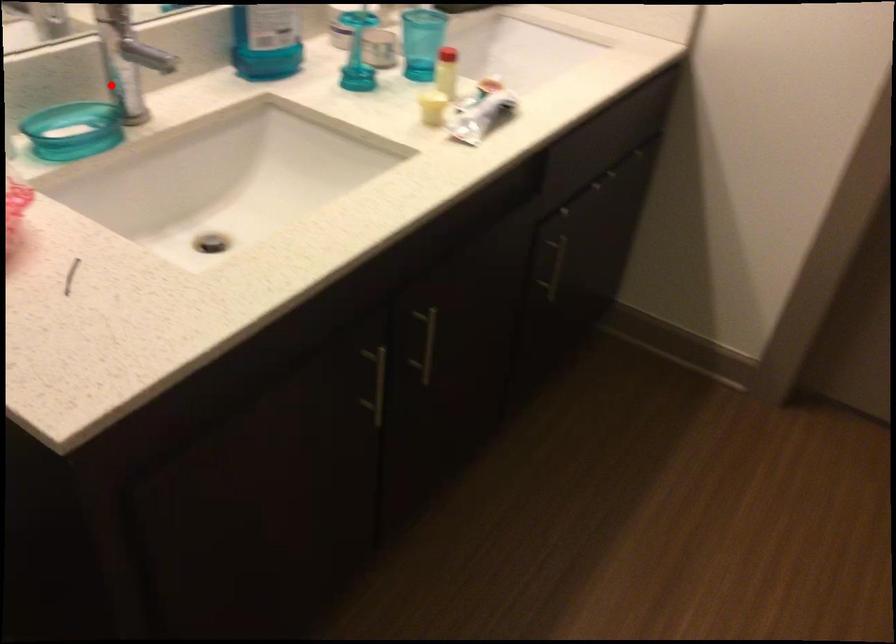
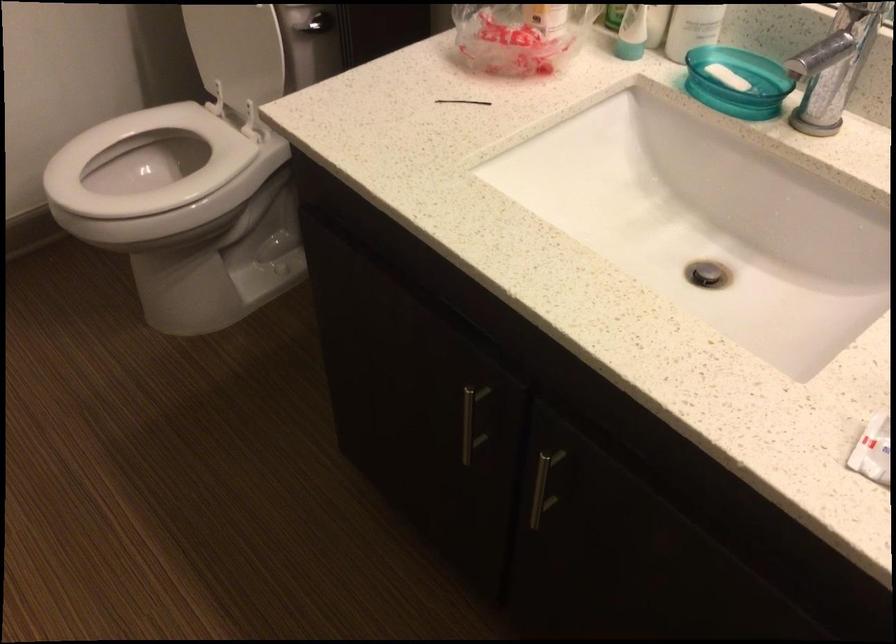
The point at the highlighted location is marked in the first image. Where is the corresponding point in the second image?

(830, 75)